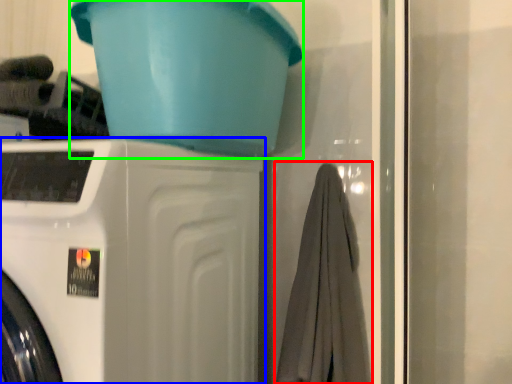
Question: Based on their relative distances, which object is farther from bath towel (highlighted by a red box)? Choose from washing machine (highlighted by a blue box) and basin (highlighted by a green box).

Choices:
 (A) washing machine
 (B) basin

Answer: (B)